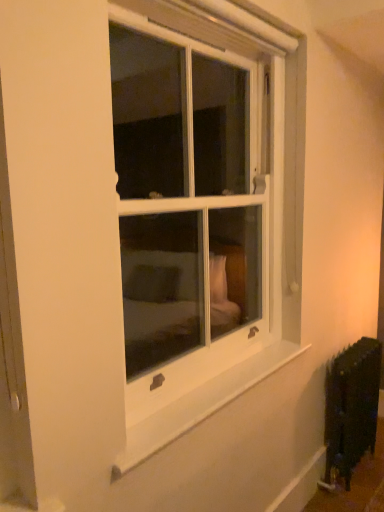
Question: Could you tell me if black matte radiator at lower right is facing white glass window at center?

Choices:
 (A) yes
 (B) no

Answer: (B)

Question: From a real-world perspective, is black matte radiator at lower right below white glass window at center?

Choices:
 (A) no
 (B) yes

Answer: (B)

Question: Can you confirm if black matte radiator at lower right is smaller than white glass window at center?

Choices:
 (A) yes
 (B) no

Answer: (A)

Question: Is black matte radiator at lower right thinner than white glass window at center?

Choices:
 (A) yes
 (B) no

Answer: (A)

Question: Is black matte radiator at lower right positioned before white glass window at center?

Choices:
 (A) yes
 (B) no

Answer: (B)

Question: From the image's perspective, is white glass window at center located above or below white smooth window sill at lower center?

Choices:
 (A) below
 (B) above

Answer: (B)

Question: In terms of size, does white glass window at center appear bigger or smaller than white smooth window sill at lower center?

Choices:
 (A) big
 (B) small

Answer: (A)

Question: Is white glass window at center in front of or behind white smooth window sill at lower center in the image?

Choices:
 (A) front
 (B) behind

Answer: (A)

Question: Considering the positions of point (225, 283) and point (283, 364), is point (225, 283) closer or farther from the camera than point (283, 364)?

Choices:
 (A) closer
 (B) farther

Answer: (B)

Question: Is black matte radiator at lower right wider or thinner than white glass window at center?

Choices:
 (A) wide
 (B) thin

Answer: (B)

Question: In terms of size, does black matte radiator at lower right appear bigger or smaller than white glass window at center?

Choices:
 (A) big
 (B) small

Answer: (B)

Question: From the image's perspective, relative to white glass window at center, is black matte radiator at lower right above or below?

Choices:
 (A) below
 (B) above

Answer: (A)

Question: Considering the relative positions of black matte radiator at lower right and white glass window at center in the image provided, is black matte radiator at lower right to the left or to the right of white glass window at center?

Choices:
 (A) left
 (B) right

Answer: (B)

Question: In terms of height, does black matte radiator at lower right look taller or shorter compared to white smooth window sill at lower center?

Choices:
 (A) short
 (B) tall

Answer: (B)

Question: Considering the positions of black matte radiator at lower right and white smooth window sill at lower center in the image, is black matte radiator at lower right wider or thinner than white smooth window sill at lower center?

Choices:
 (A) thin
 (B) wide

Answer: (B)